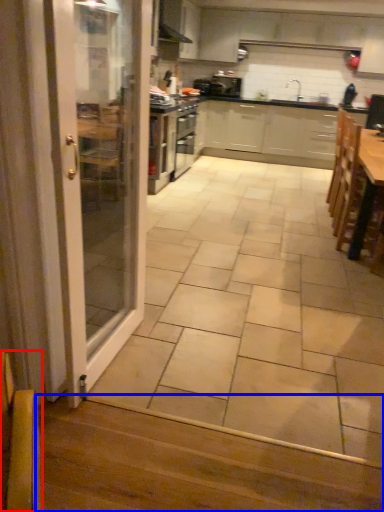
Question: Which object appears farthest to the camera in this image, armchair (highlighted by a red box) or stair (highlighted by a blue box)?

Choices:
 (A) armchair
 (B) stair

Answer: (B)